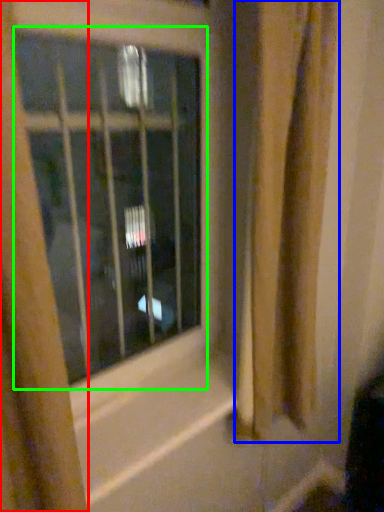
Question: Which object is positioned farthest from curtain (highlighted by a red box)? Select from shower curtain (highlighted by a blue box) and window (highlighted by a green box).

Choices:
 (A) shower curtain
 (B) window

Answer: (B)